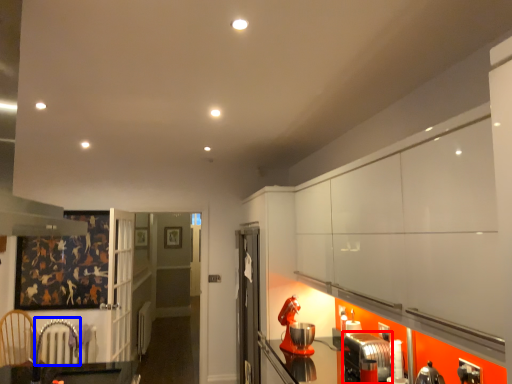
Question: Which object appears farthest to the camera in this image, appliance (highlighted by a red box) or armchair (highlighted by a blue box)?

Choices:
 (A) appliance
 (B) armchair

Answer: (B)